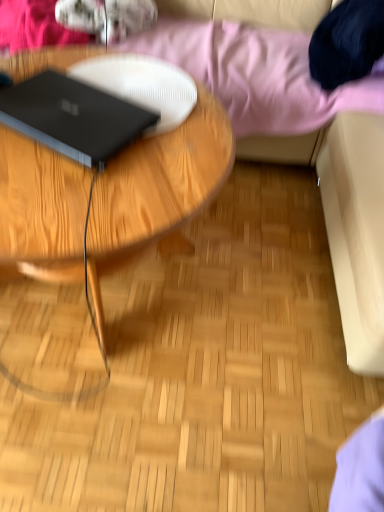
Question: From the image's perspective, is black matte laptop at left located above or below pink fabric at upper center?

Choices:
 (A) below
 (B) above

Answer: (A)

Question: Is point (79, 143) closer or farther from the camera than point (352, 80)?

Choices:
 (A) closer
 (B) farther

Answer: (A)

Question: Which object is positioned closest to the wooden coffee table at center?

Choices:
 (A) pink fabric at upper center
 (B) black matte laptop at left

Answer: (B)

Question: Estimate the real-world distances between objects in this image. Which object is closer to the black matte laptop at left?

Choices:
 (A) wooden coffee table at center
 (B) pink fabric at upper center

Answer: (A)